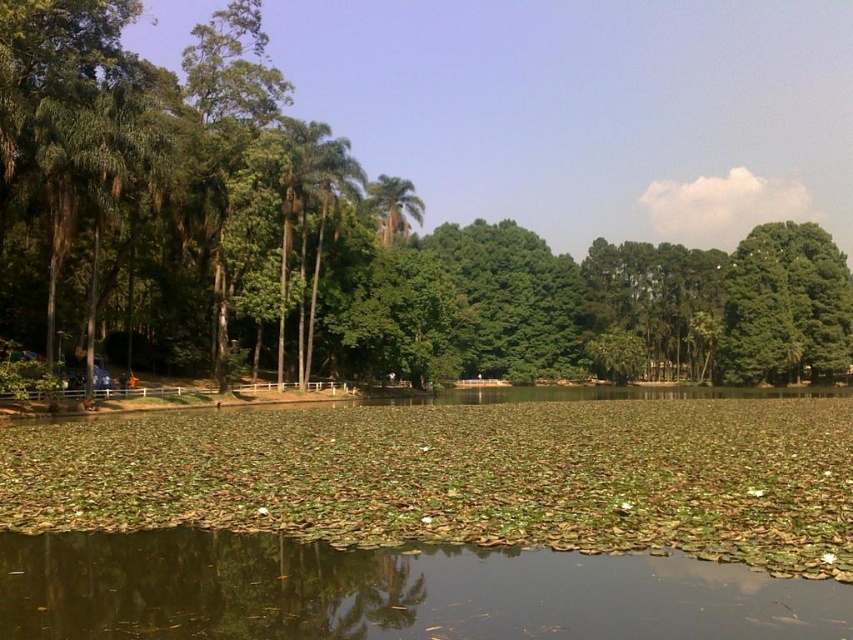
Question: Which point appears closest to the camera in this image?

Choices:
 (A) (106, 276)
 (B) (370, 193)

Answer: (A)

Question: Is green leafy tree at left below green leafy palm tree at center?

Choices:
 (A) no
 (B) yes

Answer: (A)

Question: Which object appears closest to the camera in this image?

Choices:
 (A) green leafy tree at left
 (B) green leafy palm tree at center

Answer: (A)

Question: Does green leafy tree at left have a larger size compared to green leafy palm tree at center?

Choices:
 (A) yes
 (B) no

Answer: (A)

Question: Can you confirm if green leafy tree at left is smaller than green leafy palm tree at center?

Choices:
 (A) no
 (B) yes

Answer: (A)